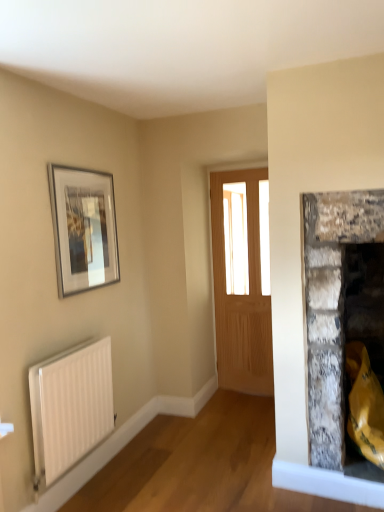
Image resolution: width=384 pixels, height=512 pixels. Identify the location of free location in front of light brown wooden door at center. (250, 406).